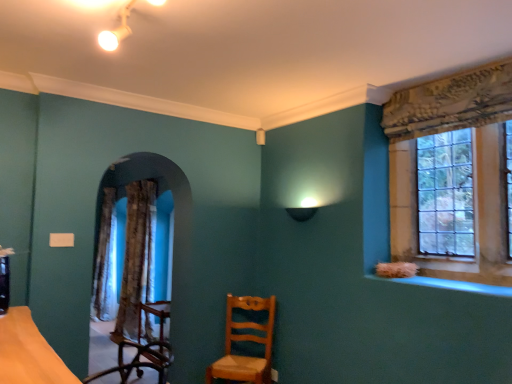
Question: Is clear glass window at upper right closer to the viewer compared to blue glossy window sill at lower right?

Choices:
 (A) no
 (B) yes

Answer: (A)

Question: Is clear glass window at upper right thinner than blue glossy window sill at lower right?

Choices:
 (A) yes
 (B) no

Answer: (A)

Question: Considering the relative positions of clear glass window at upper right and blue glossy window sill at lower right in the image provided, is clear glass window at upper right to the left of blue glossy window sill at lower right from the viewer's perspective?

Choices:
 (A) yes
 (B) no

Answer: (B)

Question: Considering the relative sizes of clear glass window at upper right and blue glossy window sill at lower right in the image provided, is clear glass window at upper right wider than blue glossy window sill at lower right?

Choices:
 (A) no
 (B) yes

Answer: (A)

Question: Is clear glass window at upper right positioned behind blue glossy window sill at lower right?

Choices:
 (A) no
 (B) yes

Answer: (B)

Question: Visually, is light brown wood chair at center positioned to the left or to the right of textured brown curtain at left?

Choices:
 (A) left
 (B) right

Answer: (B)

Question: From a real-world perspective, is light brown wood chair at center physically located above or below textured brown curtain at left?

Choices:
 (A) below
 (B) above

Answer: (A)

Question: Considering the positions of point (238, 299) and point (125, 283), is point (238, 299) closer or farther from the camera than point (125, 283)?

Choices:
 (A) closer
 (B) farther

Answer: (B)

Question: Is light brown wood chair at center wider or thinner than textured brown curtain at left?

Choices:
 (A) wide
 (B) thin

Answer: (A)

Question: From the image's perspective, is clear glass window at upper right above or below textured brown curtain at left?

Choices:
 (A) above
 (B) below

Answer: (A)

Question: Looking at the image, does clear glass window at upper right seem bigger or smaller compared to textured brown curtain at left?

Choices:
 (A) big
 (B) small

Answer: (B)

Question: Is point (496, 61) positioned closer to the camera than point (136, 226)?

Choices:
 (A) closer
 (B) farther

Answer: (A)

Question: In terms of width, does clear glass window at upper right look wider or thinner when compared to textured brown curtain at left?

Choices:
 (A) wide
 (B) thin

Answer: (B)

Question: Is point (136, 218) positioned closer to the camera than point (501, 147)?

Choices:
 (A) farther
 (B) closer

Answer: (A)

Question: Is textured brown curtain at left spatially inside clear glass window at upper right, or outside of it?

Choices:
 (A) inside
 (B) outside

Answer: (B)